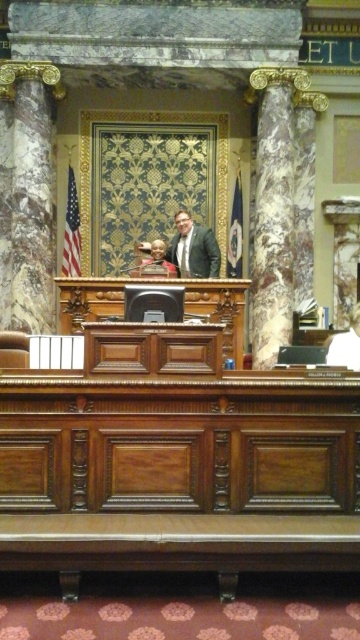
Question: Among these points, which one is nearest to the camera?

Choices:
 (A) (174, 237)
 (B) (267, 125)

Answer: (B)

Question: Is marble column at right closer to the viewer compared to matte black suit at center?

Choices:
 (A) yes
 (B) no

Answer: (A)

Question: Is the position of marble column at right less distant than that of matte black suit at center?

Choices:
 (A) no
 (B) yes

Answer: (B)

Question: Is marble column at right below matte black suit at center?

Choices:
 (A) yes
 (B) no

Answer: (B)